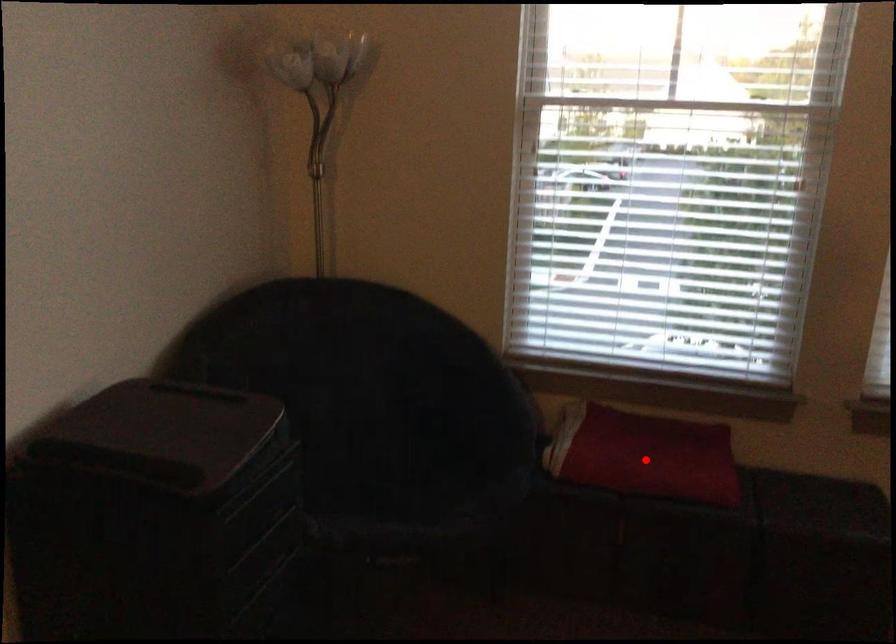
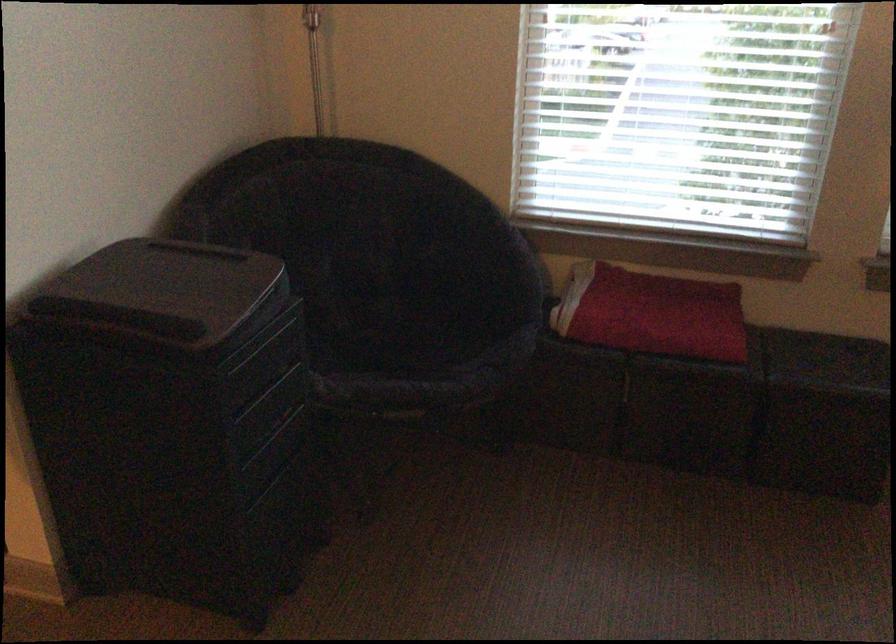
Find the pixel in the second image that matches the highlighted location in the first image.

(651, 313)